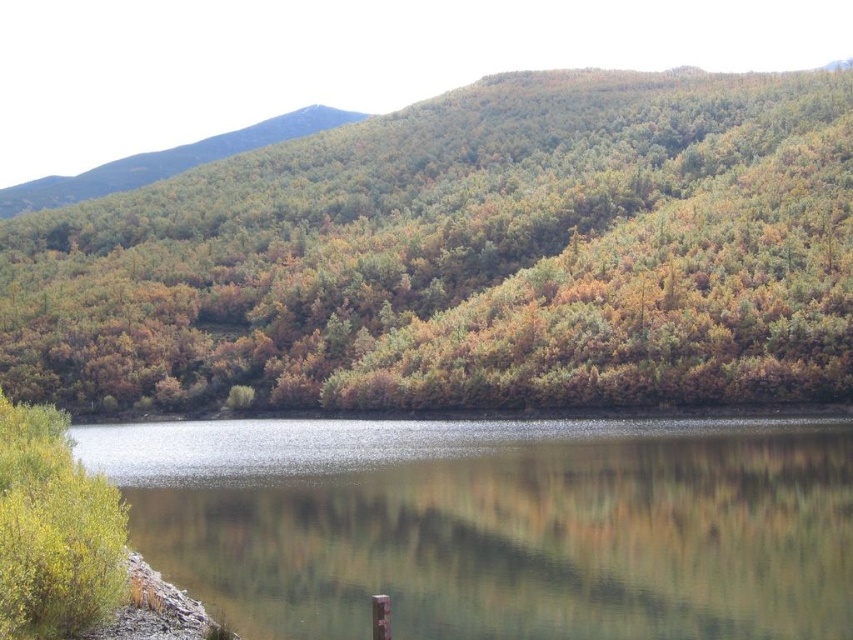
Is green matte forest at upper center to the right of clear water at center from the viewer's perspective?

In fact, green matte forest at upper center is to the left of clear water at center.

Who is positioned more to the right, green matte forest at upper center or clear water at center?

Positioned to the right is clear water at center.

Does point (614, 380) lie in front of point (541, 566)?

No, (614, 380) is behind (541, 566).

Where is `green matte forest at upper center`? The height and width of the screenshot is (640, 853). green matte forest at upper center is located at coordinates (466, 259).

Is green matte bush at lower left wider than green leafy hillside at upper left?

In fact, green matte bush at lower left might be narrower than green leafy hillside at upper left.

Between point (117, 524) and point (250, 125), which one is positioned in front?

Positioned in front is point (117, 524).

Where is `green matte bush at lower left`? green matte bush at lower left is located at coordinates (54, 531).

In the scene shown: Can you confirm if green matte forest at upper center is shorter than green matte bush at lower left?

Incorrect, green matte forest at upper center's height does not fall short of green matte bush at lower left's.

Which is behind, point (466, 276) or point (39, 540)?

Point (466, 276)

Between point (206, 356) and point (70, 593), which one is positioned behind?

Point (206, 356)

At what (x,y) coordinates should I click in order to perform the action: click on green matte forest at upper center. Please return your answer as a coordinate pair (x, y). The width and height of the screenshot is (853, 640). Looking at the image, I should click on (466, 259).